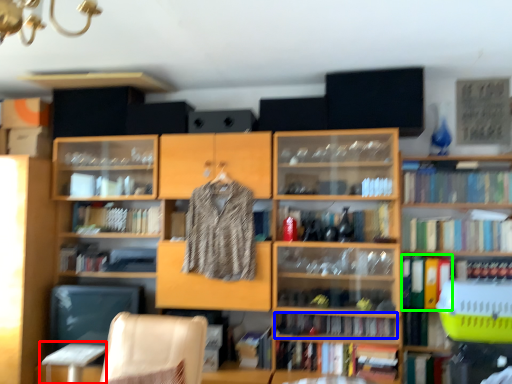
Question: Which is farther away from table (highlighted by a red box)? book (highlighted by a blue box) or book (highlighted by a green box)?

Choices:
 (A) book
 (B) book

Answer: (B)